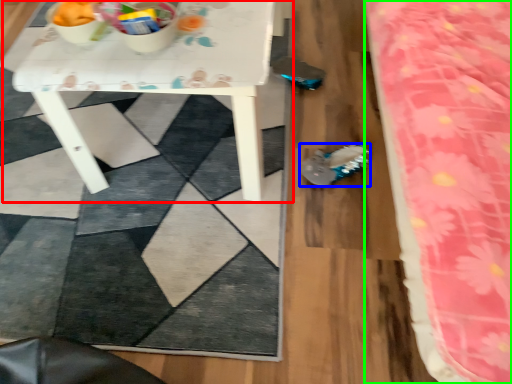
Question: Which is nearer to the table (highlighted by a red box)? footwear (highlighted by a blue box) or bed (highlighted by a green box).

Choices:
 (A) footwear
 (B) bed

Answer: (A)